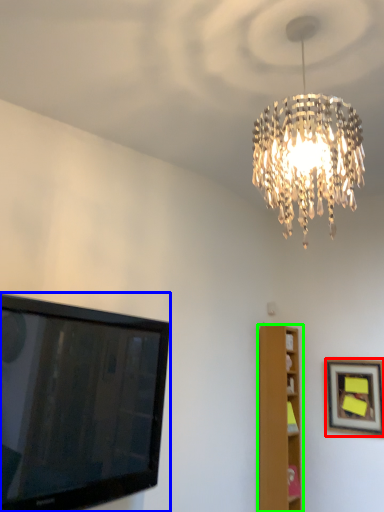
Question: Which is farther away from picture frame (highlighted by a red box)? television (highlighted by a blue box) or furniture (highlighted by a green box)?

Choices:
 (A) television
 (B) furniture

Answer: (A)